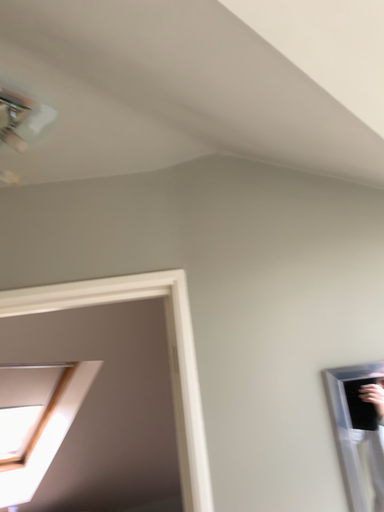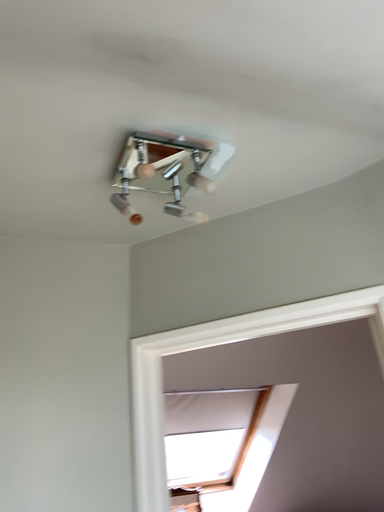
Question: How did the camera likely rotate when shooting the video?

Choices:
 (A) rotated right
 (B) rotated left

Answer: (B)